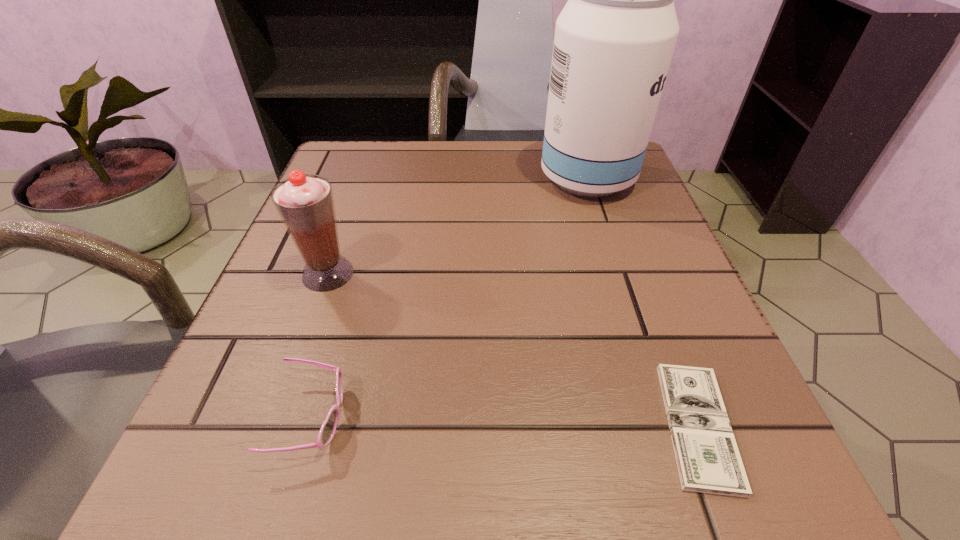
Identify the location of free spot that satisfies the following two spatial constraints: 1. on the front-facing side of the shortest object; 2. on the right side of the second shortest object. The height and width of the screenshot is (540, 960). (309, 426).